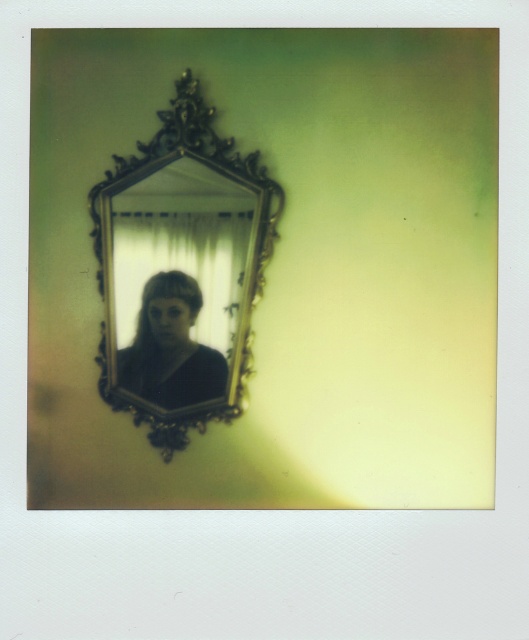
Can you confirm if gold ornate mirror at center is thinner than matte black hair at center?

No.

Does gold ornate mirror at center come in front of matte black hair at center?

Yes, gold ornate mirror at center is in front of matte black hair at center.

Identify the location of gold ornate mirror at center. The width and height of the screenshot is (529, 640). (180, 272).